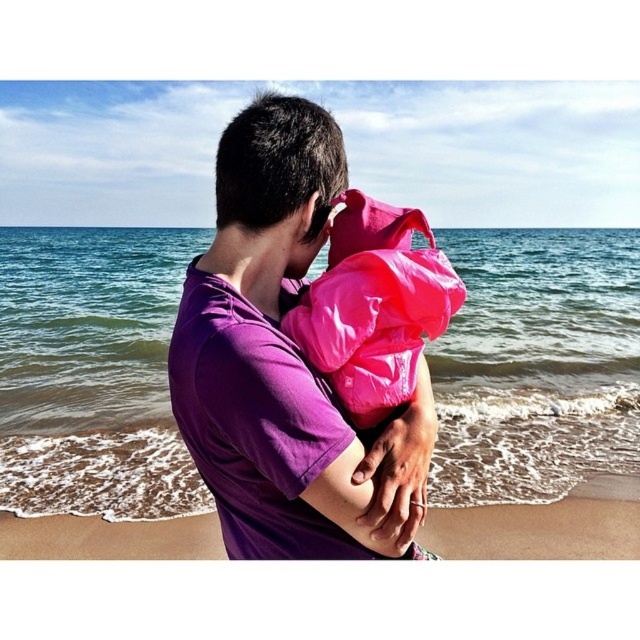
From the picture: You are a photographer planning to take a photo of the purple cotton shirt at center and the pink fabric at center. Which object should you focus on first if you want to capture both in the frame without moving the camera? Explain your reasoning based on their sizes.

The purple cotton shirt at center has a larger size compared to the pink fabric at center. Since it is larger, you should focus on the purple cotton shirt at center first to ensure it fills the frame appropriately before adjusting for the smaller pink fabric at center.

You are a photographer trying to capture the purple cotton shirt at center in the center of your photo frame. Based on the given coordinates, is the shirt already centered in the frame?

The purple cotton shirt at center is located at coordinates point (284, 362), which is close to the center of the frame but not exactly at the center point. To center it, you would need to adjust the frame slightly to the left and upwards.